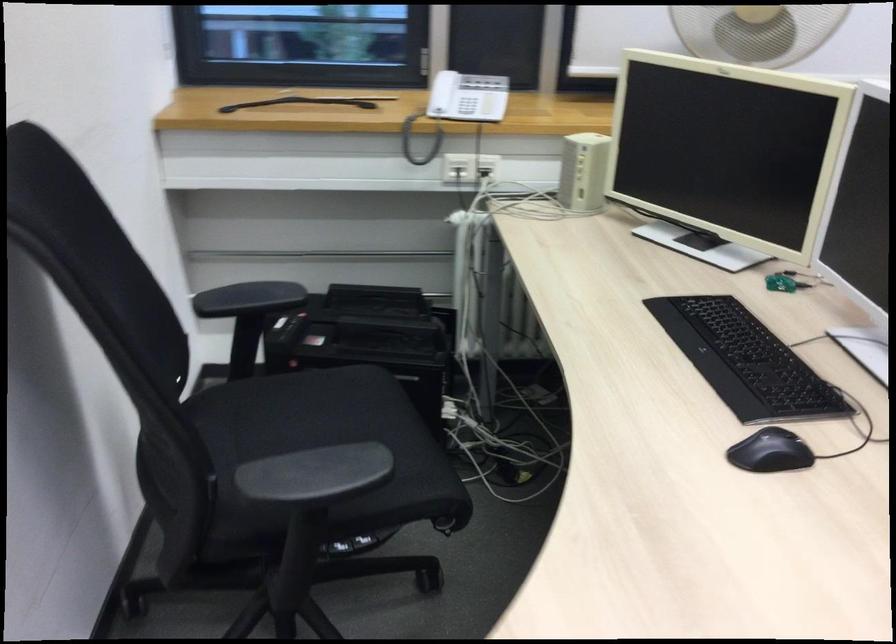
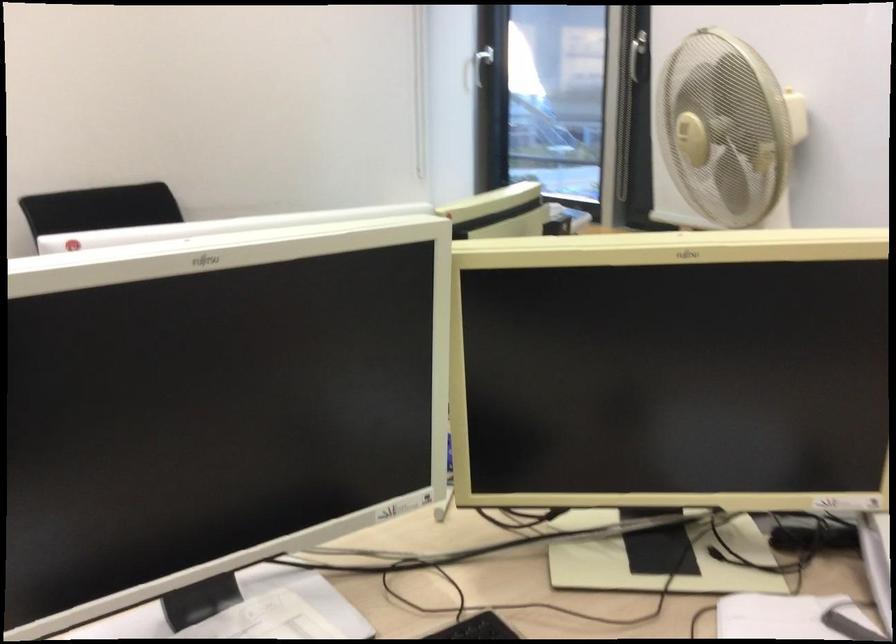
Question: I am providing you with two images of the same scene from different viewpoints. After the viewpoint changes to image2, which objects are now occluded?

Choices:
 (A) scanner lid
 (B) blender control knob
 (C) white telephone handset
 (D) white window handle

Answer: (C)